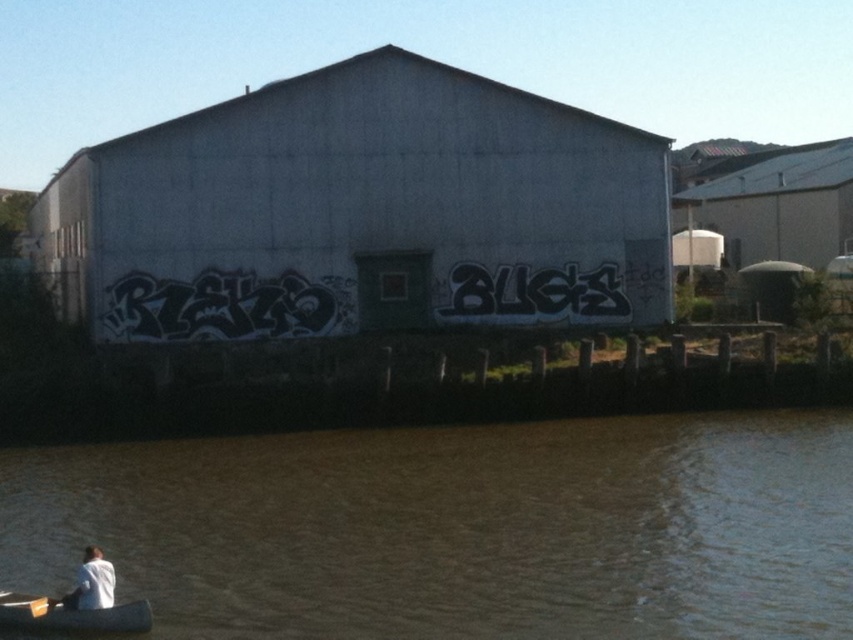
Question: Estimate the real-world distances between objects in this image. Which object is farther from the brown murky water at lower left?

Choices:
 (A) wooden canoe at lower left
 (B) white matte shirt at lower left

Answer: (B)

Question: Can you confirm if brown murky water at lower left is positioned above wooden canoe at lower left?

Choices:
 (A) no
 (B) yes

Answer: (B)

Question: Is brown murky water at lower left thinner than wooden canoe at lower left?

Choices:
 (A) yes
 (B) no

Answer: (B)

Question: Which of the following is the closest to the observer?

Choices:
 (A) wooden canoe at lower left
 (B) white matte shirt at lower left

Answer: (A)

Question: Which point is farther to the camera?

Choices:
 (A) (112, 598)
 (B) (32, 620)

Answer: (A)

Question: Does brown murky water at lower left have a larger size compared to wooden canoe at lower left?

Choices:
 (A) no
 (B) yes

Answer: (B)